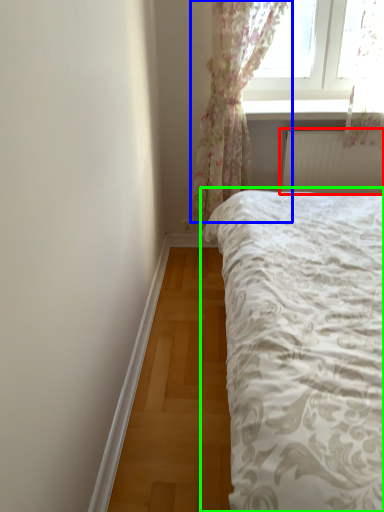
Question: Which object is positioned farthest from radiator (highlighted by a red box)? Select from curtain (highlighted by a blue box) and bed (highlighted by a green box).

Choices:
 (A) curtain
 (B) bed

Answer: (B)